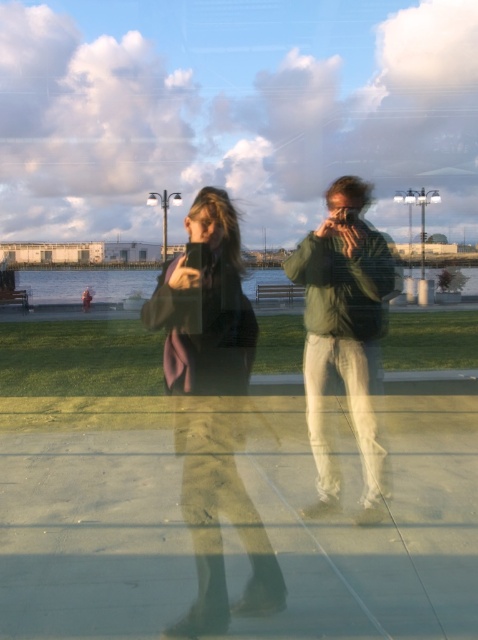
You are trying to decide which jacket to wear for a photoshoot. Both the matte black jacket at center and the green matte jacket at center are available. Based on their sizes, which one would be more suitable if you want a larger silhouette?

The matte black jacket at center is bigger than the green matte jacket at center, so it would be more suitable for a larger silhouette.

You are an observer looking at the waterfront scene through the reflective surface. You notice two jackets at the center of the image. Which jacket is positioned lower between the matte black jacket at center and the green matte jacket at center?

The matte black jacket at center is located below the green matte jacket at center, so it is positioned lower.

Looking at this image, you are standing in the waterfront scene and want to touch the exact point at coordinates point (214, 416). Which object will your finger land on?

Your finger will land on the matte black jacket at center because the point (214, 416) is located on it.